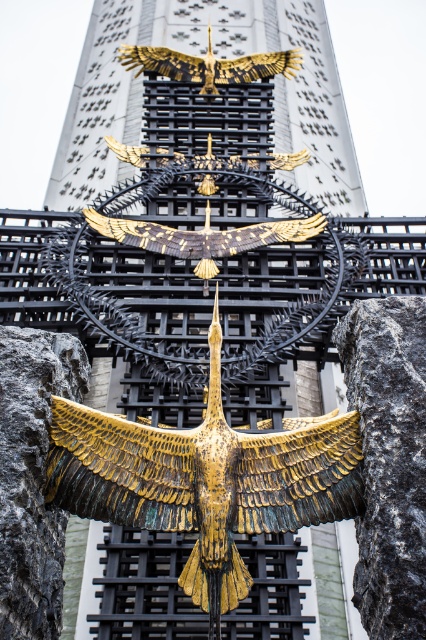
You are an art curator planning to install a new light fixture between the two points in the image. The light fixture requires a clear path between them. Can you determine if the golden bird sculpture is blocking the path between point [204,435] and point [259,237]?

Point [204,435] is in front of point [259,237], so the golden bird sculpture is not blocking the path between them because the first point is closer to the viewer.

From the picture: You are an art critic analyzing the composition of the artwork. Which of the two eagles, the gold matte eagle at center or the gold metallic eagle at upper center, is positioned higher in the image?

The gold metallic eagle at upper center is positioned higher than the gold matte eagle at center.